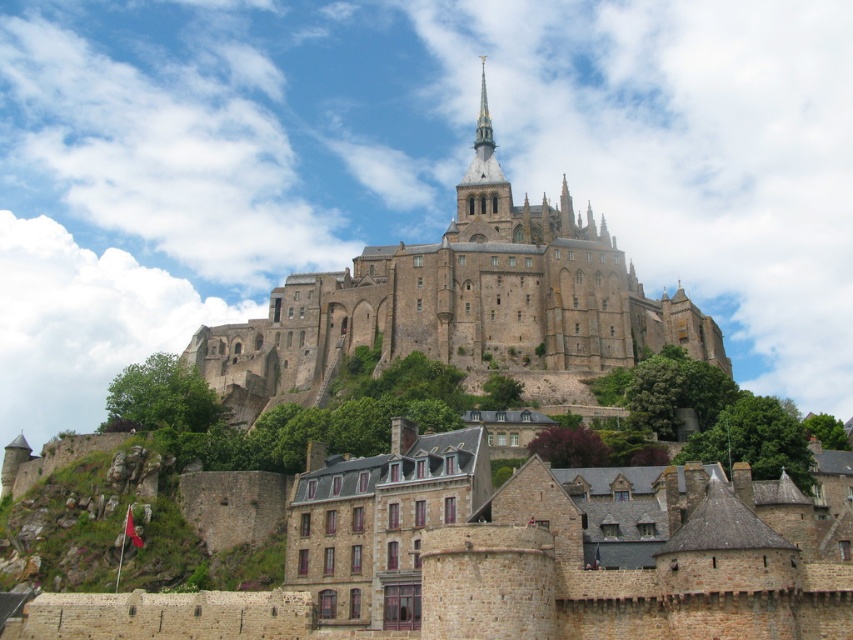
Does stone castle at center appear under smooth stone spire at upper center?

Correct, stone castle at center is located below smooth stone spire at upper center.

Does point (310, 344) come farther from viewer compared to point (469, 204)?

No, it is in front of (469, 204).

You are a GUI agent. You are given a task and a screenshot of the screen. Output one action in this format:
    pyautogui.click(x=<x>, y=<y>)
    Task: Click on the stone castle at center
    The height and width of the screenshot is (640, 853).
    Given the screenshot: What is the action you would take?
    pyautogui.click(x=457, y=301)